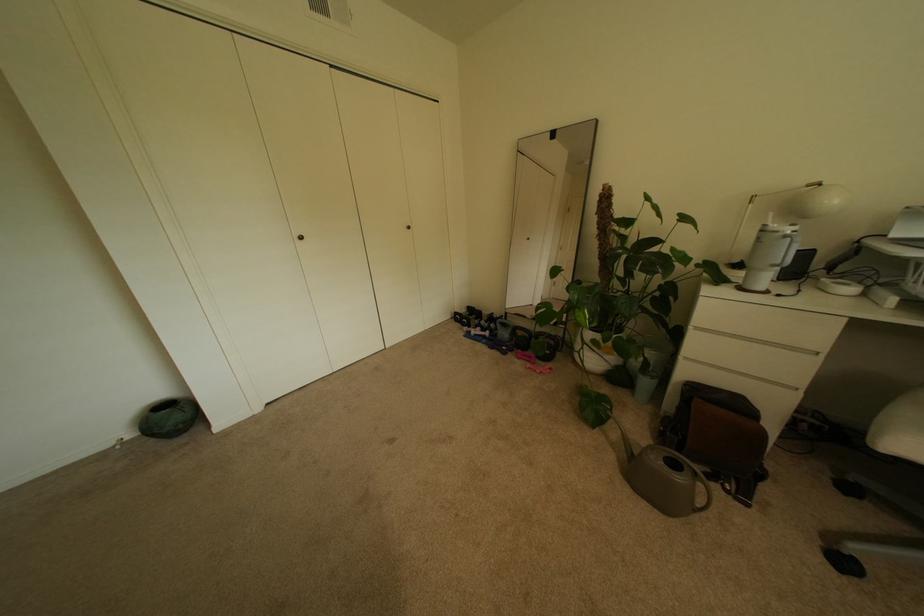
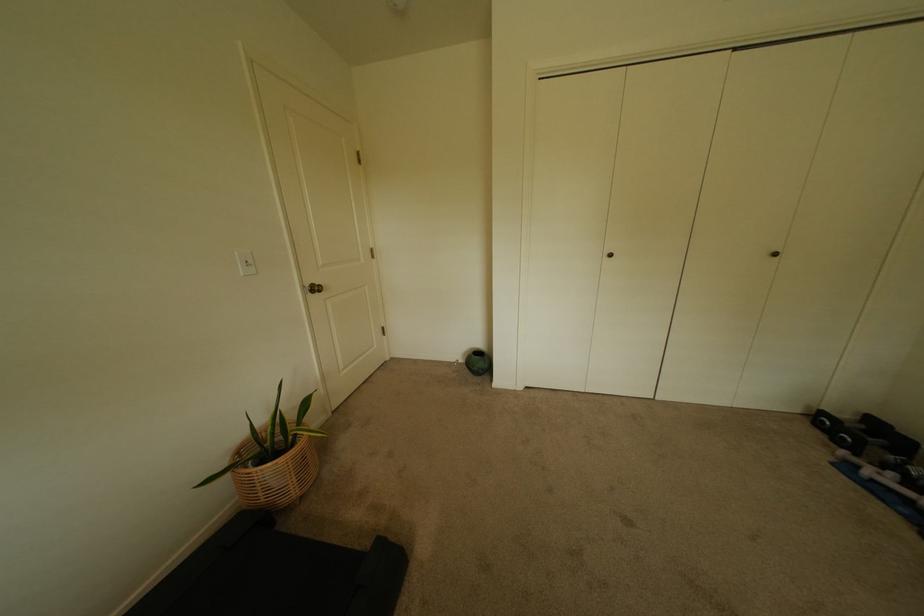
Find the pixel in the second image that matches (161,442) in the first image.

(476, 371)